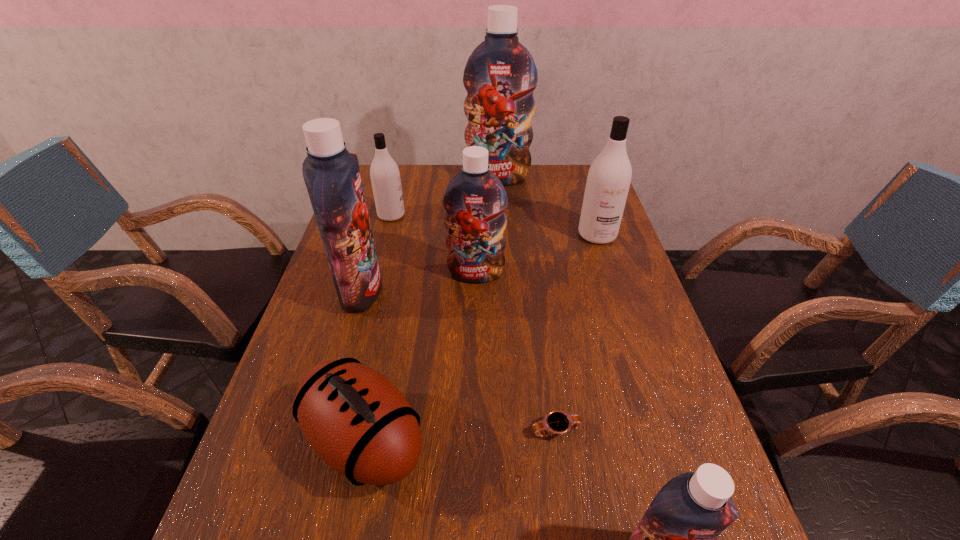
Where is `blank area in the image that satisfies the following two spatial constraints: 1. on the front label of the watch; 2. on the right side of the leftmost blue shampoo`? The width and height of the screenshot is (960, 540). blank area in the image that satisfies the following two spatial constraints: 1. on the front label of the watch; 2. on the right side of the leftmost blue shampoo is located at coordinates (321, 431).